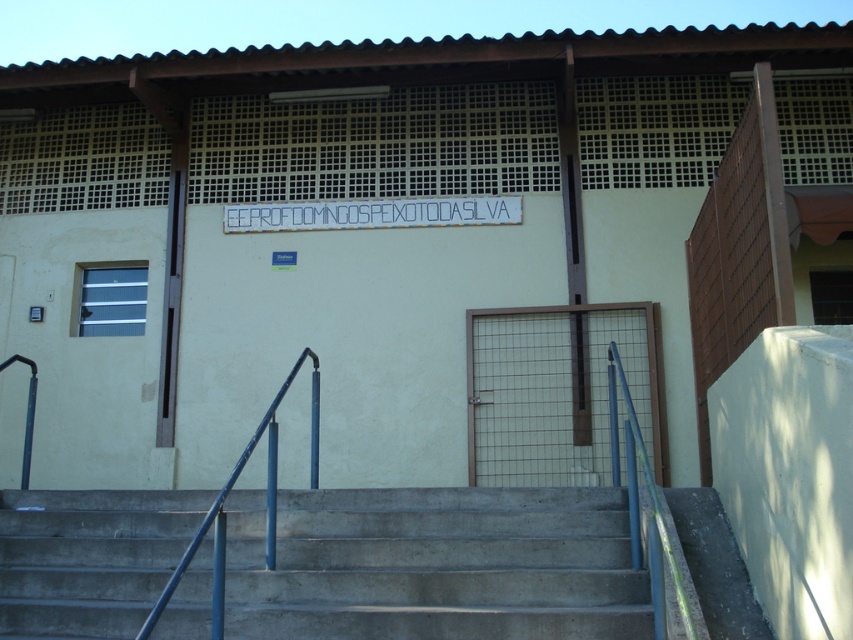
You are a visitor approaching the entrance of the building. You notice the white plastic sign at center and the blue metallic handrail at center. Which object is located above the other?

The white plastic sign at center is positioned over the blue metallic handrail at center, so the sign is above the handrail.